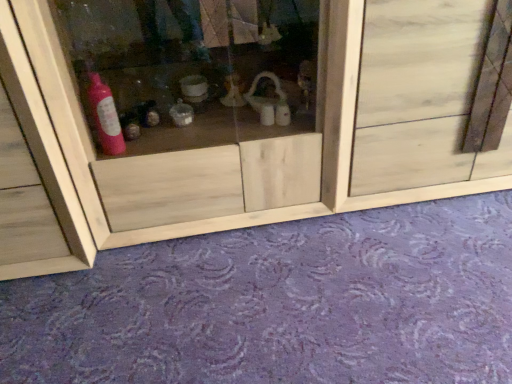
The width and height of the screenshot is (512, 384). Identify the location of transparent wood cabinet at center. (202, 104).

Where is `natural wood door at center`? natural wood door at center is located at coordinates (421, 96).

What is the approximate width of natural wood door at center?

It is 18.94 inches.

Identify the location of purple carpet at lower center. This screenshot has height=384, width=512. (281, 304).

From the image's perspective, relative to transparent wood cabinet at center, is natural wood door at center above or below?

Clearly, from the image's perspective, natural wood door at center is above transparent wood cabinet at center.

Considering the sizes of objects natural wood door at center and transparent wood cabinet at center in the image provided, who is taller, natural wood door at center or transparent wood cabinet at center?

transparent wood cabinet at center.

The width and height of the screenshot is (512, 384). Identify the location of door lying above the transparent wood cabinet at center (from the image's perspective). (421, 96).

Is point (489, 299) closer or farther from the camera than point (442, 138)?

Clearly, point (489, 299) is closer to the camera than point (442, 138).

Which of these two, purple carpet at lower center or natural wood door at center, is wider?

Wider between the two is purple carpet at lower center.

There is a purple carpet at lower center. Where is `door above it (from a real-world perspective)`? The width and height of the screenshot is (512, 384). door above it (from a real-world perspective) is located at coordinates (421, 96).

In the scene shown: Are purple carpet at lower center and natural wood door at center far apart?

No.

From a real-world perspective, is transparent wood cabinet at center beneath purple carpet at lower center?

No, from a real-world perspective, transparent wood cabinet at center is not beneath purple carpet at lower center.

Is transparent wood cabinet at center turned away from purple carpet at lower center?

transparent wood cabinet at center is not turned away from purple carpet at lower center.

Which of these two, transparent wood cabinet at center or purple carpet at lower center, is smaller?

purple carpet at lower center.

Is point (20, 309) closer or farther from the camera than point (311, 139)?

Point (20, 309) is positioned closer to the camera compared to point (311, 139).

Who is more distant, purple carpet at lower center or transparent wood cabinet at center?

transparent wood cabinet at center.

Is purple carpet at lower center not close to transparent wood cabinet at center?

purple carpet at lower center is actually quite close to transparent wood cabinet at center.

Does natural wood door at center come behind purple carpet at lower center?

Yes, natural wood door at center is behind purple carpet at lower center.

From a real-world perspective, is natural wood door at center physically below purple carpet at lower center?

Incorrect, from a real-world perspective, natural wood door at center is higher than purple carpet at lower center.

From the image's perspective, which one is positioned higher, natural wood door at center or purple carpet at lower center?

natural wood door at center appears higher in the image.

What's the angular difference between natural wood door at center and purple carpet at lower center's facing directions?

The facing directions of natural wood door at center and purple carpet at lower center are 90.2 degrees apart.

Considering the positions of objects transparent wood cabinet at center and natural wood door at center in the image provided, who is behind, transparent wood cabinet at center or natural wood door at center?

natural wood door at center is further away from the camera.

Which of these two, transparent wood cabinet at center or natural wood door at center, is wider?

With larger width is transparent wood cabinet at center.

In the scene shown: From a real-world perspective, which is physically above, transparent wood cabinet at center or natural wood door at center?

transparent wood cabinet at center, from a real-world perspective.

Where is `glass door above the natural wood door at center (from a real-world perspective)`? glass door above the natural wood door at center (from a real-world perspective) is located at coordinates (202, 104).

I want to click on plain that appears on the left of natural wood door at center, so click(281, 304).

From the image, which object appears to be farther from transparent wood cabinet at center, purple carpet at lower center or natural wood door at center?

purple carpet at lower center is further to transparent wood cabinet at center.

Looking at this image, looking at the image, which one is located further to natural wood door at center, purple carpet at lower center or transparent wood cabinet at center?

The object further to natural wood door at center is purple carpet at lower center.

Looking at the image, which one is located further to purple carpet at lower center, natural wood door at center or transparent wood cabinet at center?

natural wood door at center is further to purple carpet at lower center.

Estimate the real-world distances between objects in this image. Which object is further from natural wood door at center, transparent wood cabinet at center or purple carpet at lower center?

purple carpet at lower center is further to natural wood door at center.

Looking at the image, which one is located further to purple carpet at lower center, transparent wood cabinet at center or natural wood door at center?

natural wood door at center is positioned further to the anchor purple carpet at lower center.

Considering their positions, is natural wood door at center positioned further to transparent wood cabinet at center than purple carpet at lower center?

purple carpet at lower center lies further to transparent wood cabinet at center than the other object.

Find the location of `plain between transparent wood cabinet at center and natural wood door at center in the horizontal direction`. plain between transparent wood cabinet at center and natural wood door at center in the horizontal direction is located at coordinates point(281,304).